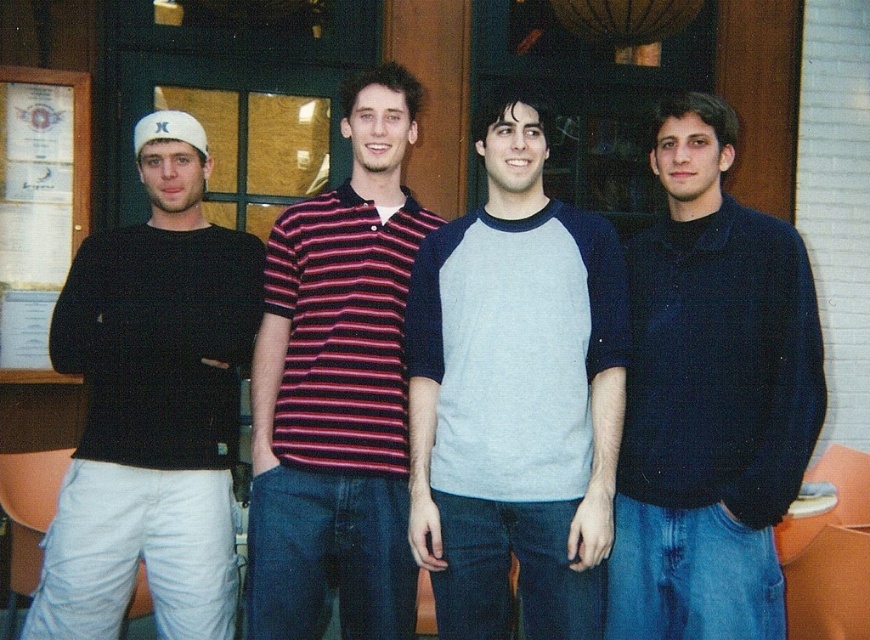
Question: Is light gray cotton t-shirt at center to the left of dark blue polo shirt at right from the viewer's perspective?

Choices:
 (A) no
 (B) yes

Answer: (B)

Question: Which of the following is the farthest from the observer?

Choices:
 (A) (196, 221)
 (B) (385, 561)
 (C) (30, 364)

Answer: (C)

Question: Does dark blue polo shirt at right have a lesser width compared to striped polo shirt at center?

Choices:
 (A) yes
 (B) no

Answer: (A)

Question: Is black matte shirt at left wider than striped polo shirt at center?

Choices:
 (A) yes
 (B) no

Answer: (A)

Question: Which object appears farthest from the camera in this image?

Choices:
 (A) striped polo shirt at center
 (B) white paperboard at left
 (C) black matte shirt at left
 (D) dark blue polo shirt at right

Answer: (B)

Question: Which point appears closest to the camera in this image?

Choices:
 (A) (437, 416)
 (B) (137, 230)
 (C) (786, 426)

Answer: (C)